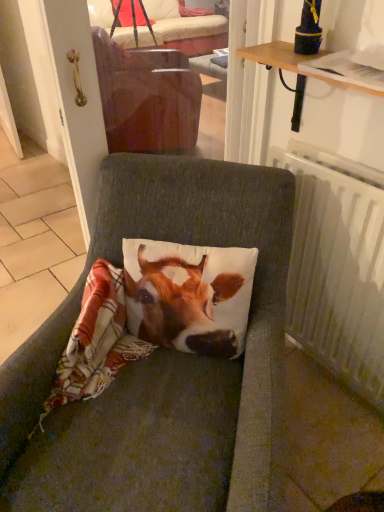
Question: Is point (1, 432) closer or farther from the camera than point (334, 345)?

Choices:
 (A) closer
 (B) farther

Answer: (A)

Question: Considering their positions, is textured gray cushion at center located in front of or behind white plastic radiator at right?

Choices:
 (A) front
 (B) behind

Answer: (A)

Question: Is textured gray cushion at center bigger or smaller than white plastic radiator at right?

Choices:
 (A) small
 (B) big

Answer: (B)

Question: From the image's perspective, is white plastic radiator at right above or below textured gray cushion at center?

Choices:
 (A) below
 (B) above

Answer: (B)

Question: Does point (316, 166) appear closer or farther from the camera than point (145, 506)?

Choices:
 (A) closer
 (B) farther

Answer: (B)

Question: Do you think white plastic radiator at right is within textured gray cushion at center, or outside of it?

Choices:
 (A) inside
 (B) outside

Answer: (B)

Question: Is white plastic radiator at right wider or thinner than textured gray cushion at center?

Choices:
 (A) thin
 (B) wide

Answer: (A)